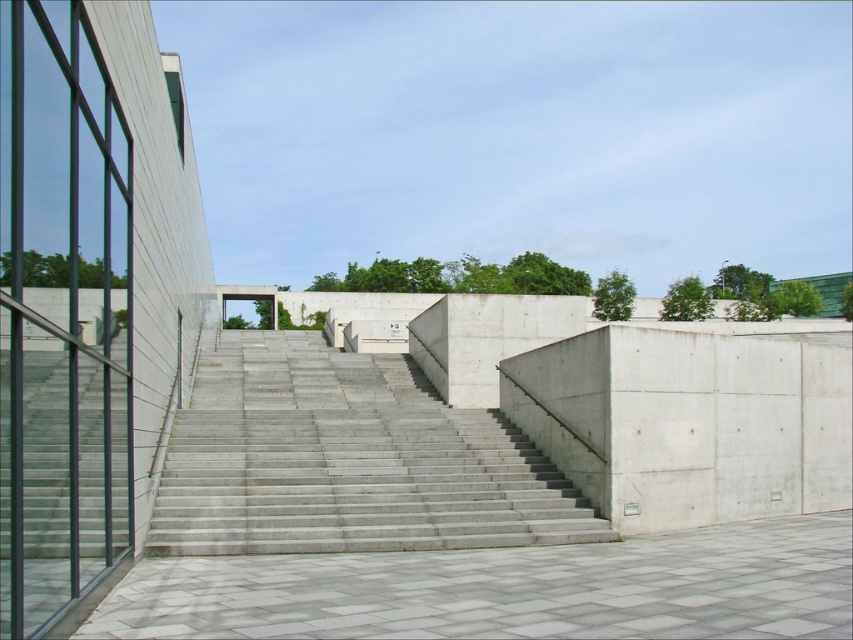
You are standing on the gray concrete pavement at center and want to reach the top of the gray concrete stairs at center. Which direction should you move to ascend the stairs?

The gray concrete stairs at center are to the left of the gray concrete pavement at center, so to ascend the stairs, you should move to your left.

You are standing at the entrance of the building and want to walk up the gray concrete stairs at center. However, there is a gray concrete pavement at center in front of you. Which object is closer to you, the stairs or the pavement?

The gray concrete stairs at center are closer to you than the gray concrete pavement at center because the stairs are positioned further to the viewer compared to the pavement.

You are standing at the base of the gray concrete stairs at center and want to reach the gray concrete pavement at center. Which direction should you move to get there?

The gray concrete stairs at center is much taller than the gray concrete pavement at center, so you should move downward along the gray concrete stairs at center to reach the gray concrete pavement at center.